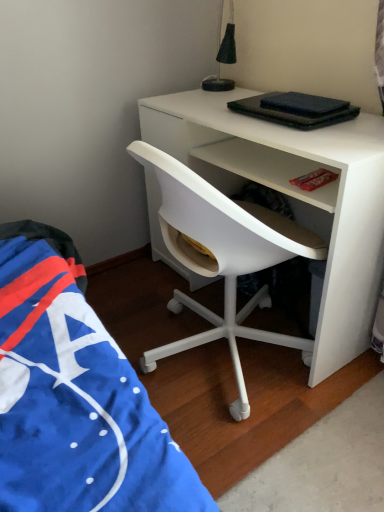
I want to click on black fabric lampshade at upper center, so click(223, 55).

What is the approximate width of black fabric lampshade at upper center?

black fabric lampshade at upper center is 9.74 inches in width.

The width and height of the screenshot is (384, 512). What do you see at coordinates (223, 55) in the screenshot? I see `black fabric lampshade at upper center` at bounding box center [223, 55].

Describe the element at coordinates (222, 257) in the screenshot. I see `white plastic chair at center` at that location.

Measure the distance between white plastic chair at center and camera.

They are 38.20 inches apart.

Locate an element on the screen. This screenshot has width=384, height=512. white plastic chair at center is located at coordinates (222, 257).

Find the location of a particular element. black fabric lampshade at upper center is located at coordinates (223, 55).

Considering the relative positions of white plastic chair at center and black fabric lampshade at upper center in the image provided, is white plastic chair at center to the left of black fabric lampshade at upper center from the viewer's perspective?

In fact, white plastic chair at center is to the right of black fabric lampshade at upper center.

Is the position of white plastic chair at center less distant than that of black fabric lampshade at upper center?

Yes, white plastic chair at center is closer to the camera.

Does point (214, 217) come farther from viewer compared to point (227, 48)?

No.

From the image's perspective, which one is positioned higher, white plastic chair at center or black fabric lampshade at upper center?

black fabric lampshade at upper center is shown above in the image.

From a real-world perspective, is white plastic chair at center over black fabric lampshade at upper center?

No, from a real-world perspective, white plastic chair at center is not above black fabric lampshade at upper center.

Which object is wider, white plastic chair at center or black fabric lampshade at upper center?

white plastic chair at center.

Is white plastic chair at center taller or shorter than black fabric lampshade at upper center?

Considering their sizes, white plastic chair at center has more height than black fabric lampshade at upper center.

Which of these two, white plastic chair at center or black fabric lampshade at upper center, is bigger?

Bigger between the two is white plastic chair at center.

Is black fabric lampshade at upper center located within white plastic chair at center?

That's incorrect, black fabric lampshade at upper center is not inside white plastic chair at center.

Is white plastic chair at center in contact with black fabric lampshade at upper center?

No, white plastic chair at center is not touching black fabric lampshade at upper center.

Is white plastic chair at center positioned with its back to black fabric lampshade at upper center?

white plastic chair at center is not turned away from black fabric lampshade at upper center.

Can you tell me how much white plastic chair at center and black fabric lampshade at upper center differ in facing direction?

40.7 degrees separate the facing orientations of white plastic chair at center and black fabric lampshade at upper center.

Where is `lamp that is behind the white plastic chair at center`? Image resolution: width=384 pixels, height=512 pixels. lamp that is behind the white plastic chair at center is located at coordinates (223, 55).

Which object is positioned more to the left, black fabric lampshade at upper center or white plastic chair at center?

From the viewer's perspective, black fabric lampshade at upper center appears more on the left side.

Considering the relative positions of black fabric lampshade at upper center and white plastic chair at center in the image provided, is black fabric lampshade at upper center in front of white plastic chair at center?

No, it is behind white plastic chair at center.

Is point (202, 88) farther from viewer compared to point (237, 356)?

Yes, point (202, 88) is behind point (237, 356).

From the image's perspective, which one is positioned higher, black fabric lampshade at upper center or white plastic chair at center?

black fabric lampshade at upper center, from the image's perspective.

From a real-world perspective, is black fabric lampshade at upper center above or below white plastic chair at center?

From a real-world perspective, black fabric lampshade at upper center is physically above white plastic chair at center.

Can you confirm if black fabric lampshade at upper center is wider than white plastic chair at center?

In fact, black fabric lampshade at upper center might be narrower than white plastic chair at center.

Which of these two, black fabric lampshade at upper center or white plastic chair at center, stands taller?

Standing taller between the two is white plastic chair at center.

Considering the relative sizes of black fabric lampshade at upper center and white plastic chair at center in the image provided, is black fabric lampshade at upper center smaller than white plastic chair at center?

Indeed, black fabric lampshade at upper center has a smaller size compared to white plastic chair at center.

Is black fabric lampshade at upper center inside the boundaries of white plastic chair at center, or outside?

black fabric lampshade at upper center cannot be found inside white plastic chair at center.

Is there a large distance between black fabric lampshade at upper center and white plastic chair at center?

No, black fabric lampshade at upper center is not far away from white plastic chair at center.

Consider the image. Is black fabric lampshade at upper center oriented towards white plastic chair at center?

No, black fabric lampshade at upper center does not turn towards white plastic chair at center.

How different are the orientations of black fabric lampshade at upper center and white plastic chair at center in degrees?

40.7 degrees separate the facing orientations of black fabric lampshade at upper center and white plastic chair at center.

The image size is (384, 512). Identify the location of chair to the right of black fabric lampshade at upper center. point(222,257).

I want to click on lamp above the white plastic chair at center (from the image's perspective), so click(223, 55).

The width and height of the screenshot is (384, 512). I want to click on chair that appears below the black fabric lampshade at upper center (from the image's perspective), so click(222, 257).